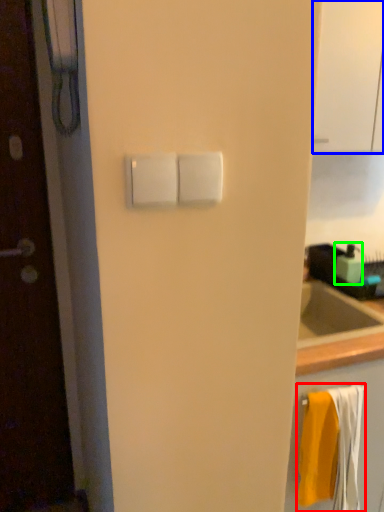
Question: Which is farther away from bath towel (highlighted by a red box)? glass door (highlighted by a blue box) or soap dispenser (highlighted by a green box)?

Choices:
 (A) glass door
 (B) soap dispenser

Answer: (A)